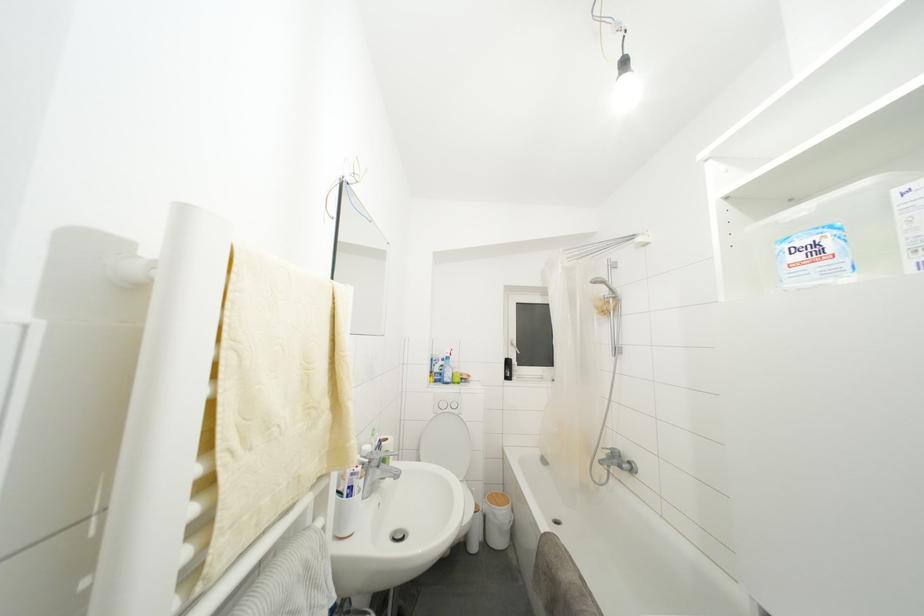
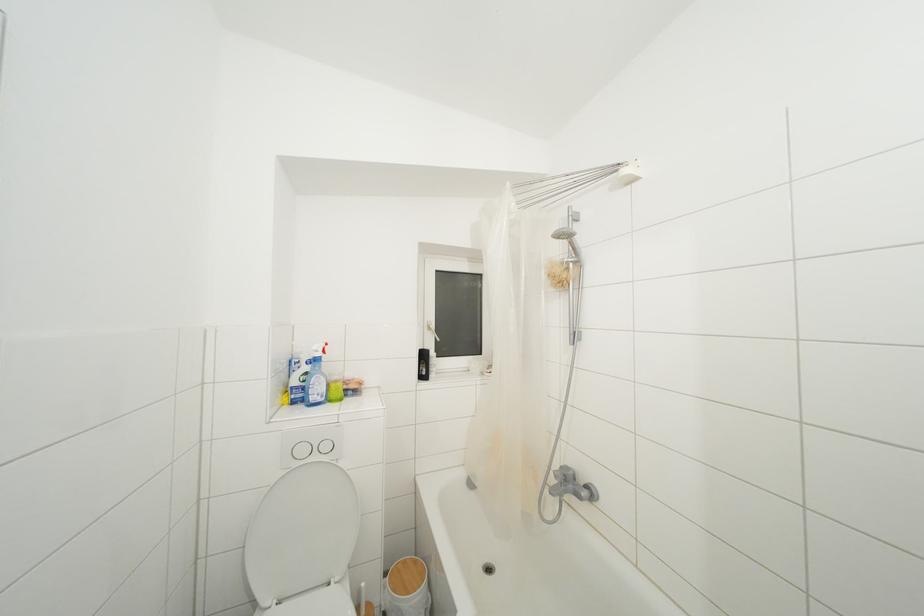
The point at (513, 368) is marked in the first image. Where is the corresponding point in the second image?

(428, 361)